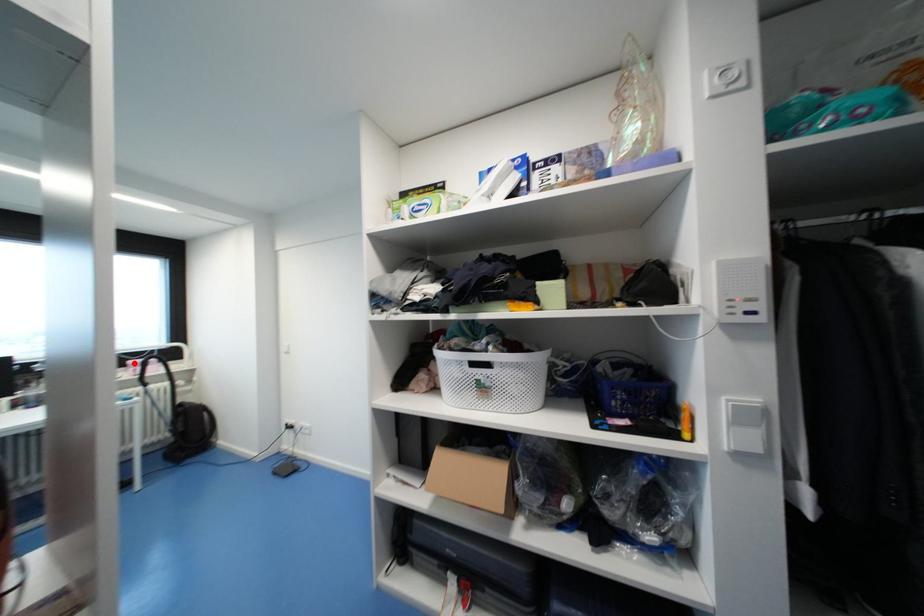
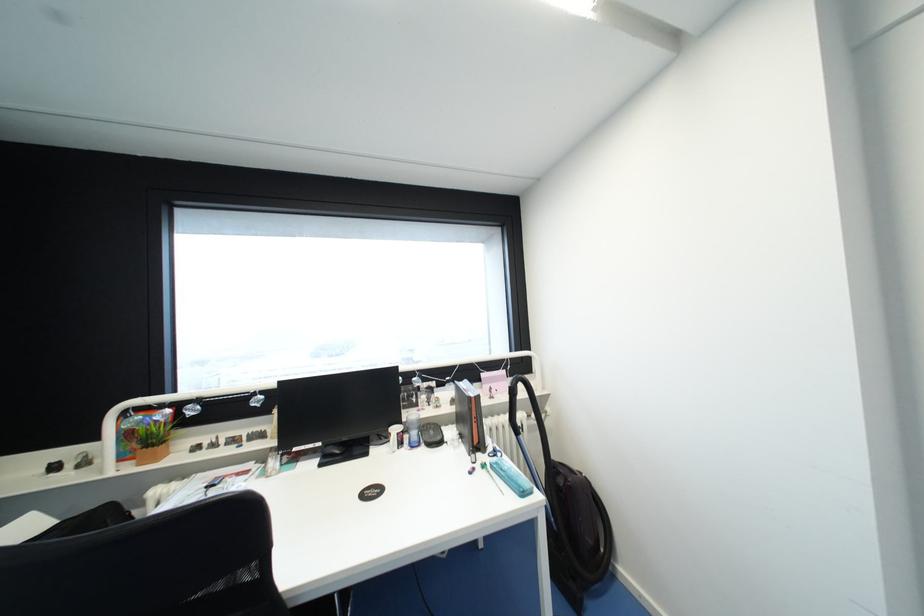
Find the pixel in the second image that matches the highlighted location in the first image.

(488, 376)